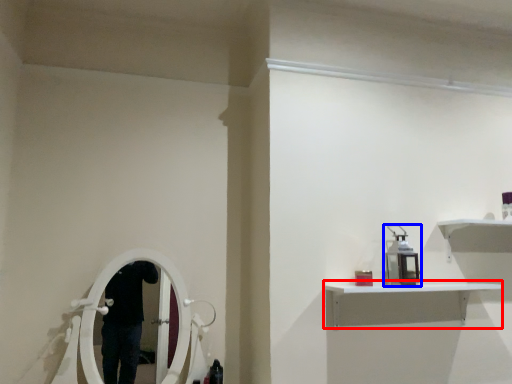
Question: Which object is closer to the camera taking this photo, shelf (highlighted by a red box) or equipment (highlighted by a blue box)?

Choices:
 (A) shelf
 (B) equipment

Answer: (A)